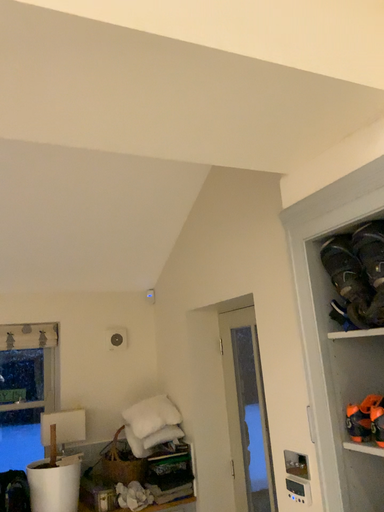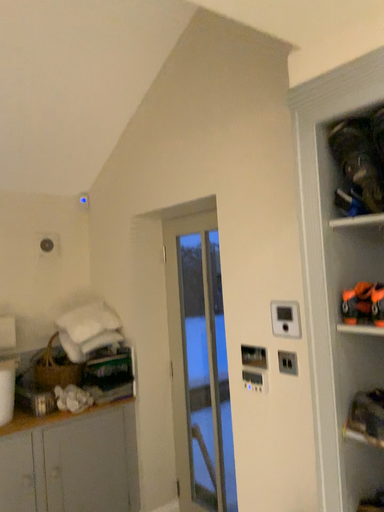
Question: How did the camera likely rotate when shooting the video?

Choices:
 (A) rotated downward
 (B) rotated upward

Answer: (A)